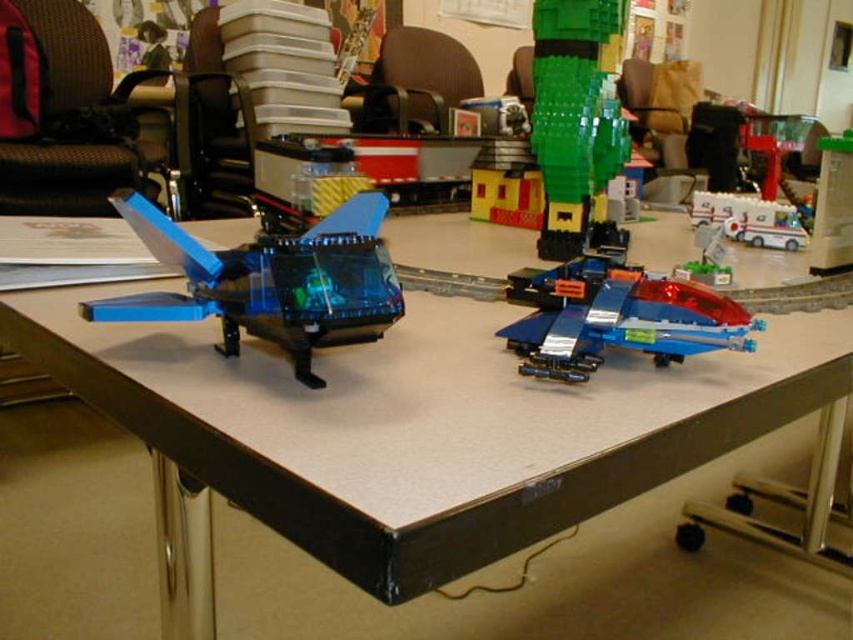
You are a visitor looking at the smooth gray table at center and the green lego figure at upper right. From your perspective, which object is positioned to the left?

The smooth gray table at center is to the left of the green lego figure at upper right, so the smooth gray table at center is positioned to the left.

You are trying to place a new LEGO model on the smooth gray table at center. If you want to position it exactly at the center of the table, where should you place it?

The smooth gray table at center is located at point (422, 424), so you should place the new LEGO model at those coordinates to position it exactly at the center of the table.

You are standing at the edge of the table looking at the LEGO models. There are two points marked on the table surface, point [642,440] and point [573,129]. Which point is closer to you?

Point [642,440] is closer to the viewer than point [573,129].